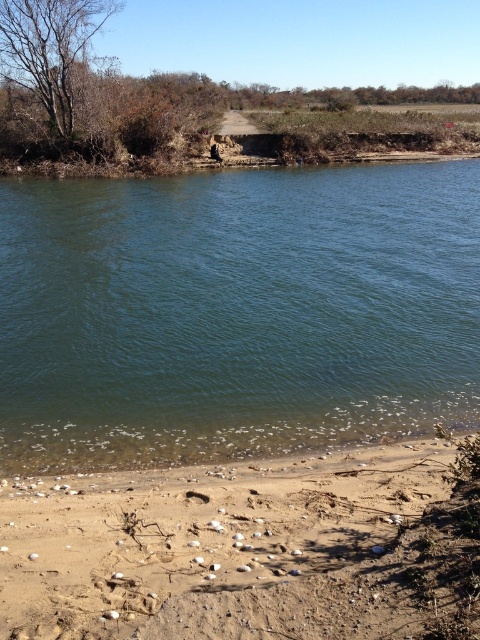
Which is more to the right, green smooth water at center or brown sandy beach at lower right?

Positioned to the right is brown sandy beach at lower right.

Describe the element at coordinates (236, 312) in the screenshot. I see `green smooth water at center` at that location.

Is point (160, 284) in front of point (66, 547)?

No, it is behind (66, 547).

This screenshot has width=480, height=640. Identify the location of green smooth water at center. (236, 312).